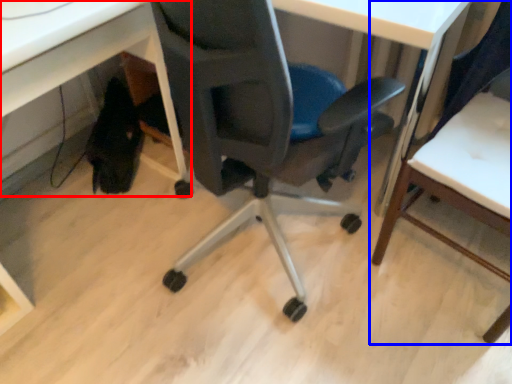
Question: Which of the following is the farthest to the observer, computer desk (highlighted by a red box) or chair (highlighted by a blue box)?

Choices:
 (A) computer desk
 (B) chair

Answer: (A)